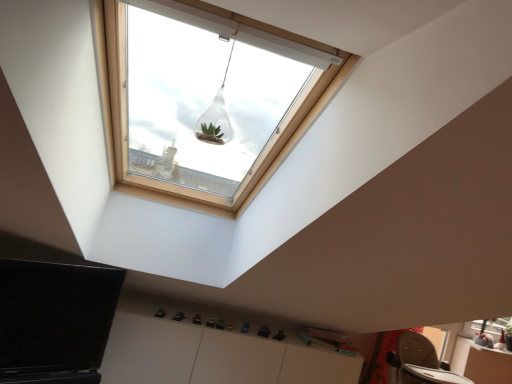
Question: In which direction should I rotate to look at transparent glass terrarium at upper center?

Choices:
 (A) right
 (B) left

Answer: (B)

Question: From the image's perspective, is transparent glass terrarium at upper center over white matte cabinet at lower center?

Choices:
 (A) yes
 (B) no

Answer: (A)

Question: Considering the relative positions of transparent glass terrarium at upper center and white matte cabinet at lower center in the image provided, is transparent glass terrarium at upper center in front of white matte cabinet at lower center?

Choices:
 (A) no
 (B) yes

Answer: (B)

Question: Considering the relative sizes of transparent glass terrarium at upper center and white matte cabinet at lower center in the image provided, is transparent glass terrarium at upper center thinner than white matte cabinet at lower center?

Choices:
 (A) no
 (B) yes

Answer: (B)

Question: From the image's perspective, is transparent glass terrarium at upper center located beneath white matte cabinet at lower center?

Choices:
 (A) yes
 (B) no

Answer: (B)

Question: From a real-world perspective, is transparent glass terrarium at upper center located beneath white matte cabinet at lower center?

Choices:
 (A) yes
 (B) no

Answer: (B)

Question: Is transparent glass terrarium at upper center bigger than white matte cabinet at lower center?

Choices:
 (A) yes
 (B) no

Answer: (B)

Question: Does white matte cabinet at lower center turn towards transparent glass terrarium at upper center?

Choices:
 (A) no
 (B) yes

Answer: (A)

Question: Are white matte cabinet at lower center and transparent glass terrarium at upper center located far from each other?

Choices:
 (A) no
 (B) yes

Answer: (B)

Question: Is white matte cabinet at lower center closer to camera compared to transparent glass terrarium at upper center?

Choices:
 (A) yes
 (B) no

Answer: (B)

Question: Does white matte cabinet at lower center have a greater height compared to transparent glass terrarium at upper center?

Choices:
 (A) no
 (B) yes

Answer: (B)

Question: From a real-world perspective, is white matte cabinet at lower center positioned under transparent glass terrarium at upper center based on gravity?

Choices:
 (A) no
 (B) yes

Answer: (B)

Question: Can you confirm if white matte cabinet at lower center is thinner than transparent glass terrarium at upper center?

Choices:
 (A) yes
 (B) no

Answer: (B)

Question: From the image's perspective, relative to transparent glass terrarium at upper center, is white matte cabinet at lower center above or below?

Choices:
 (A) below
 (B) above

Answer: (A)